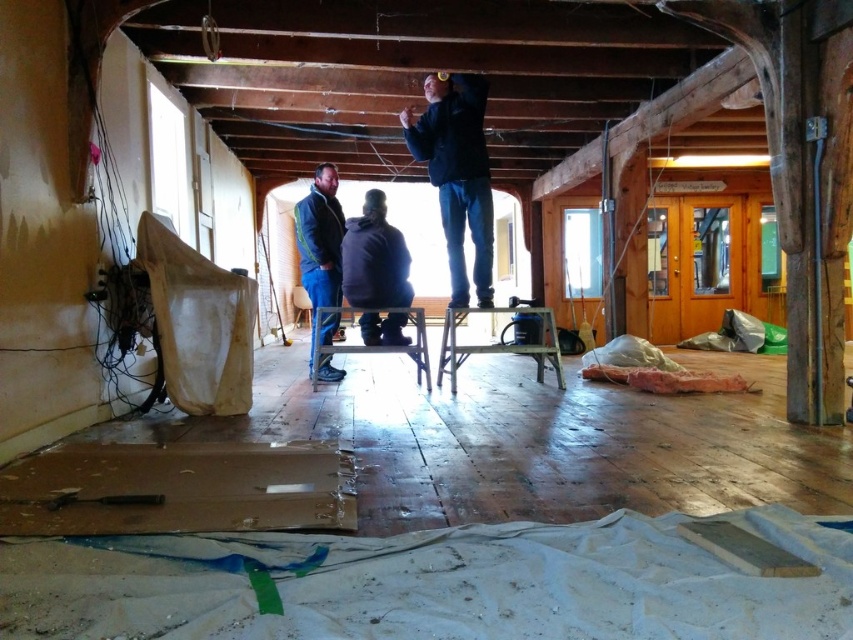
Consider the image. Does dark blue jacket at upper center have a greater height compared to blue denim jacket at center?

Yes.

Image resolution: width=853 pixels, height=640 pixels. In order to click on dark blue jacket at upper center in this screenshot , I will do `click(457, 173)`.